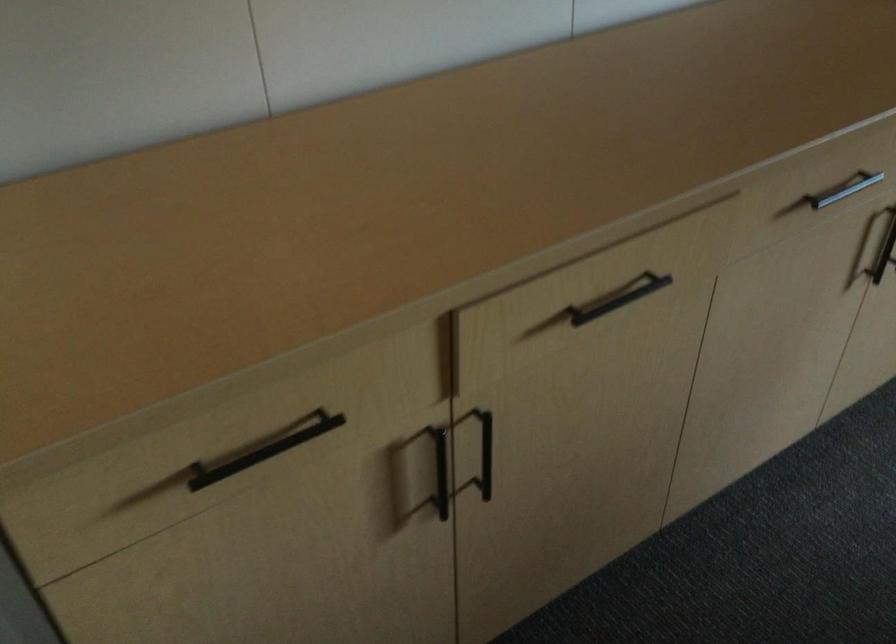
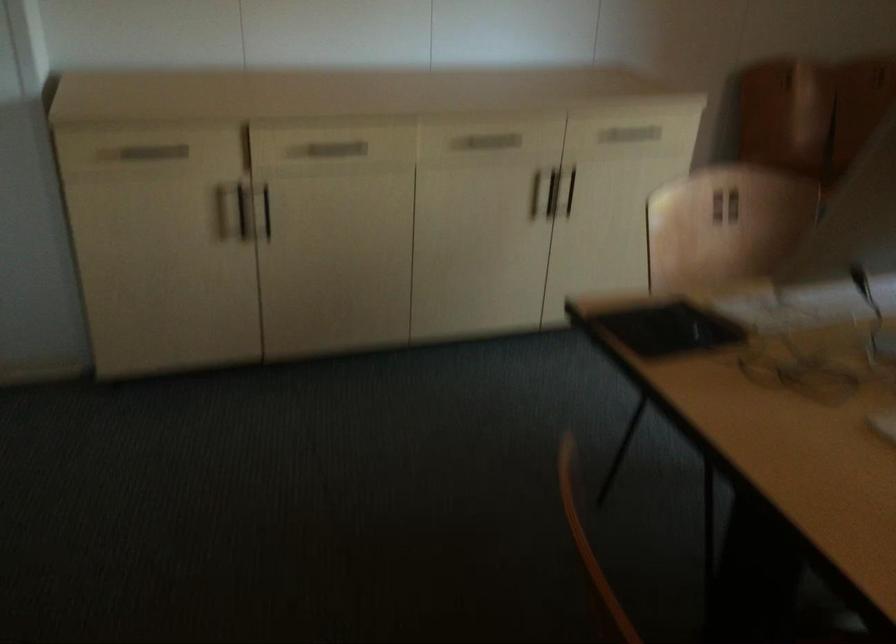
Where in the second image is the point corresponding to (x=476, y=448) from the first image?

(264, 211)